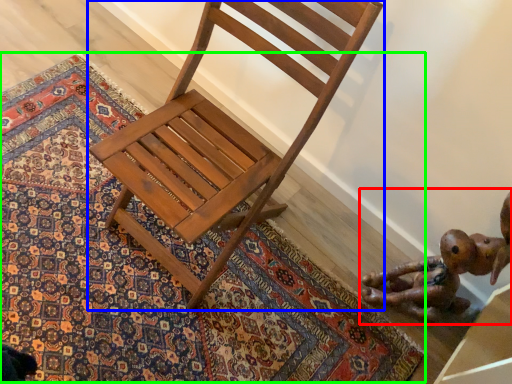
Question: Considering the real-world distances, which object is closest to toy (highlighted by a red box)? chair (highlighted by a blue box) or mat (highlighted by a green box).

Choices:
 (A) chair
 (B) mat

Answer: (B)